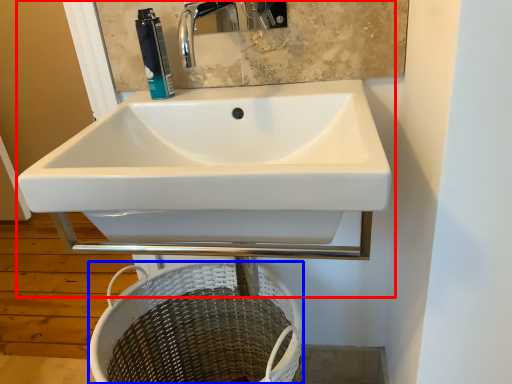
Question: Which point is closer to the camera, sink (highlighted by a red box) or basket (highlighted by a blue box)?

Choices:
 (A) sink
 (B) basket

Answer: (A)